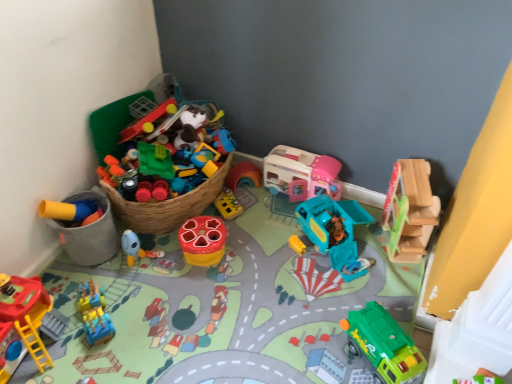
This screenshot has width=512, height=384. In order to click on vacant space to the left of blue plastic train at lower left, acting as the seventh toy starting from the right in this screenshot , I will do `click(64, 309)`.